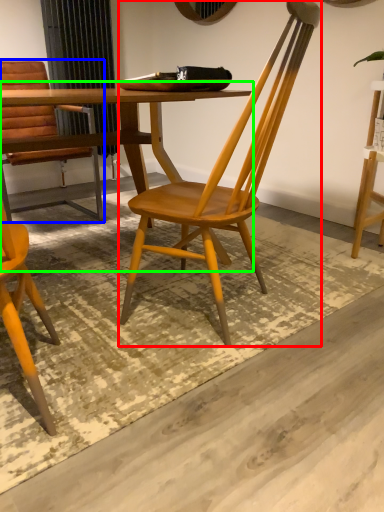
Question: Based on their relative distances, which object is nearer to chair (highlighted by a red box)? Choose from chair (highlighted by a blue box) and table (highlighted by a green box).

Choices:
 (A) chair
 (B) table

Answer: (B)